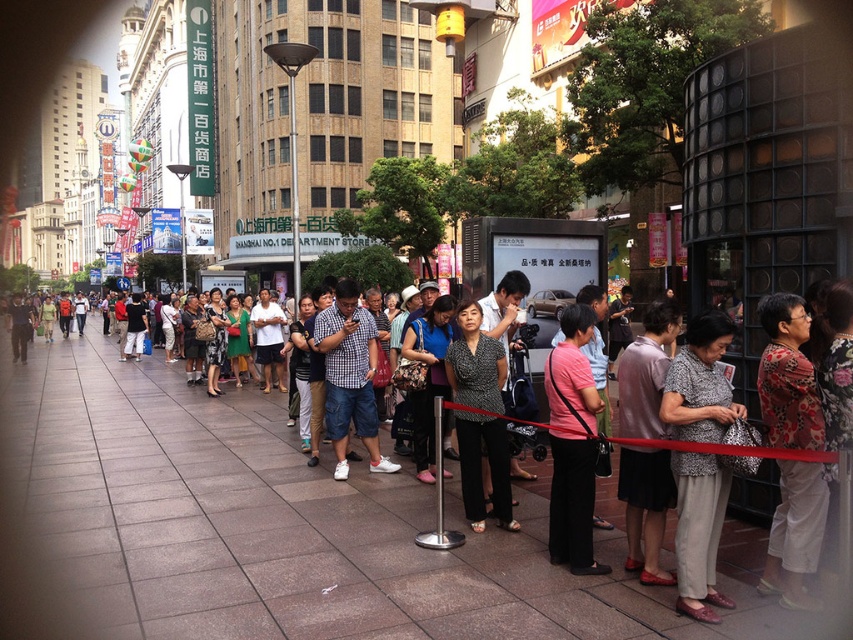
Can you confirm if matte pink blouse at center is shorter than checkered fabric shirt at center?

Correct, matte pink blouse at center is not as tall as checkered fabric shirt at center.

Who is taller, matte pink blouse at center or checkered fabric shirt at center?

checkered fabric shirt at center

Is point (637, 545) positioned after point (343, 445)?

No, (637, 545) is in front of (343, 445).

Identify the location of matte pink blouse at center. The image size is (853, 640). (645, 508).

Can you confirm if printed fabric blouse at center is positioned to the left of black dotted blouse at center?

In fact, printed fabric blouse at center is to the right of black dotted blouse at center.

Is printed fabric blouse at center thinner than black dotted blouse at center?

Correct, printed fabric blouse at center's width is less than black dotted blouse at center's.

Does point (697, 584) come closer to viewer compared to point (469, 451)?

Yes, it is in front of point (469, 451).

The width and height of the screenshot is (853, 640). In order to click on printed fabric blouse at center in this screenshot , I will do point(698,531).

Does brown stone pavement at center appear on the right side of floral-patterned blouse at lower right?

Incorrect, brown stone pavement at center is not on the right side of floral-patterned blouse at lower right.

I want to click on brown stone pavement at center, so click(x=279, y=529).

Identify the location of brown stone pavement at center. (279, 529).